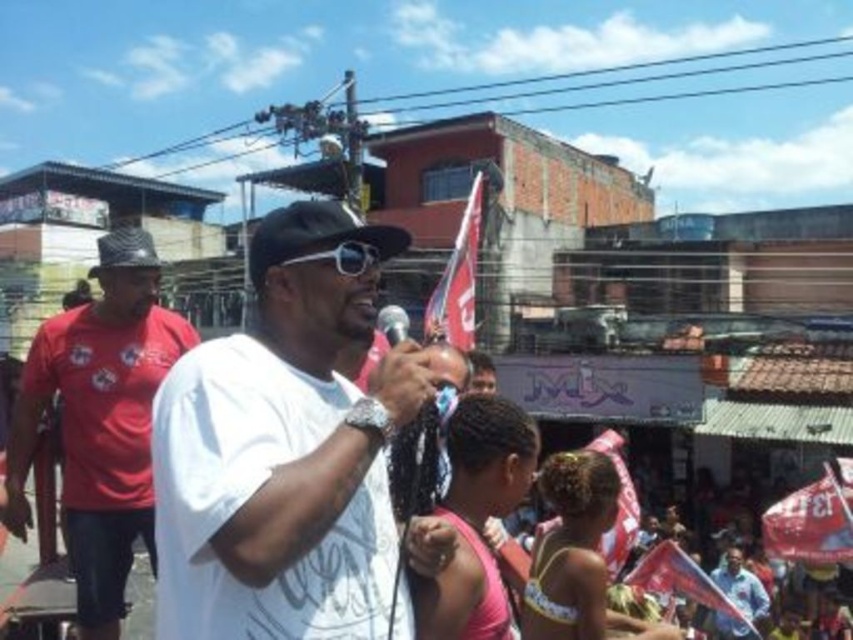
Question: Does black matte baseball cap at center appear over blue fabric flag at lower right?

Choices:
 (A) yes
 (B) no

Answer: (A)

Question: Among these objects, which one is farthest from the camera?

Choices:
 (A) matte black baseball cap at left
 (B) matte red shirt at left
 (C) red fabric flag at center

Answer: (A)

Question: Can you confirm if matte pink bikini top at lower center is bigger than red fabric flag at center?

Choices:
 (A) yes
 (B) no

Answer: (B)

Question: Can you confirm if matte pink bikini top at lower center is positioned below red fabric flag at upper center?

Choices:
 (A) yes
 (B) no

Answer: (A)

Question: Which of the following is the farthest from the observer?

Choices:
 (A) blue fabric flag at lower right
 (B) red fabric flag at upper center
 (C) metallic silver microphone at center

Answer: (A)

Question: Which object appears farthest from the camera in this image?

Choices:
 (A) white matte t-shirt at center
 (B) matte black baseball cap at left
 (C) matte pink bikini top at lower center
 (D) metallic silver microphone at center

Answer: (B)